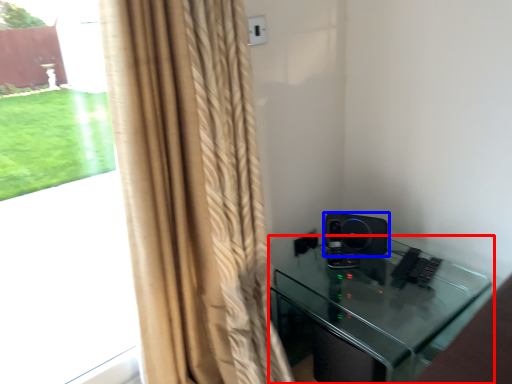
Question: Which of the following is the closest to the observer, furniture (highlighted by a red box) or speaker (highlighted by a blue box)?

Choices:
 (A) furniture
 (B) speaker

Answer: (A)